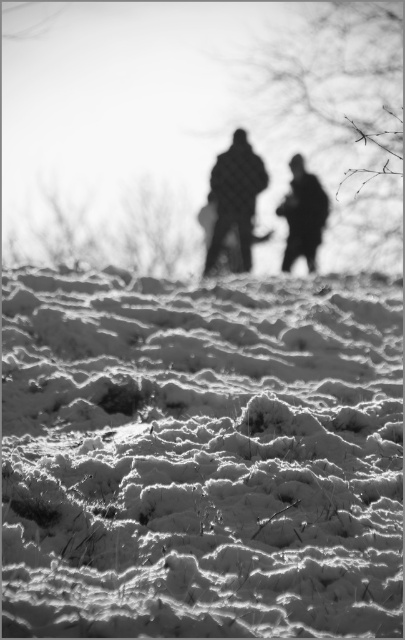
Question: Which object is farther from the camera taking this photo?

Choices:
 (A) silhouette clothing at center
 (B) frosted white snow at lower center

Answer: (A)

Question: Which object appears farthest from the camera in this image?

Choices:
 (A) silhouette clothing at center
 (B) frosted white snow at lower center

Answer: (A)

Question: Does frosted white snow at lower center have a lesser width compared to silhouette clothing at center?

Choices:
 (A) yes
 (B) no

Answer: (B)

Question: Does frosted white snow at lower center lie in front of silhouette clothing at center?

Choices:
 (A) no
 (B) yes

Answer: (B)

Question: Does frosted white snow at lower center have a greater width compared to silhouette clothing at center?

Choices:
 (A) no
 (B) yes

Answer: (B)